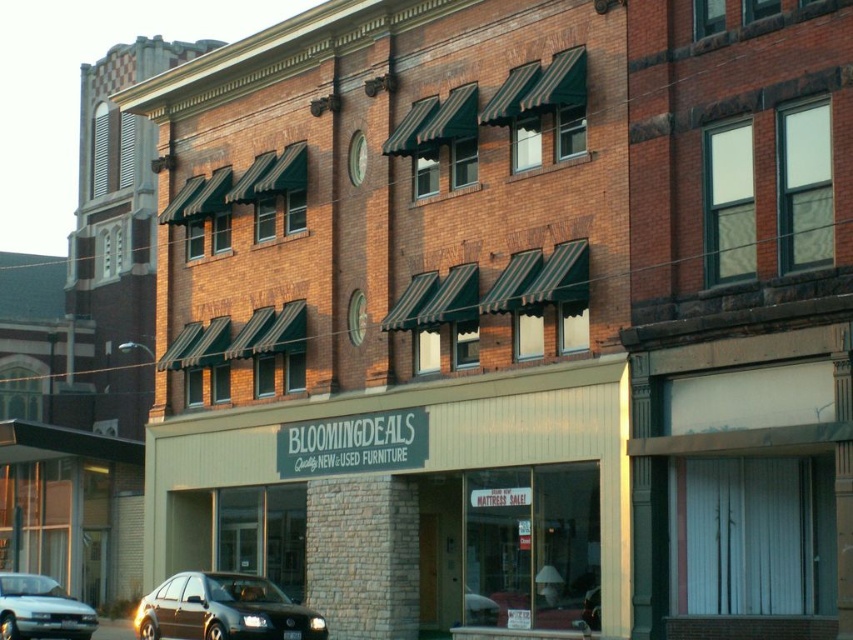
Is satin black sedan at lower left to the left of silver metallic sedan at lower left from the viewer's perspective?

Incorrect, satin black sedan at lower left is not on the left side of silver metallic sedan at lower left.

Which is in front, point (253, 582) or point (62, 604)?

Positioned in front is point (253, 582).

Does point (192, 627) come farther from viewer compared to point (20, 593)?

No, (192, 627) is in front of (20, 593).

In order to click on satin black sedan at lower left in this screenshot , I will do `click(223, 609)`.